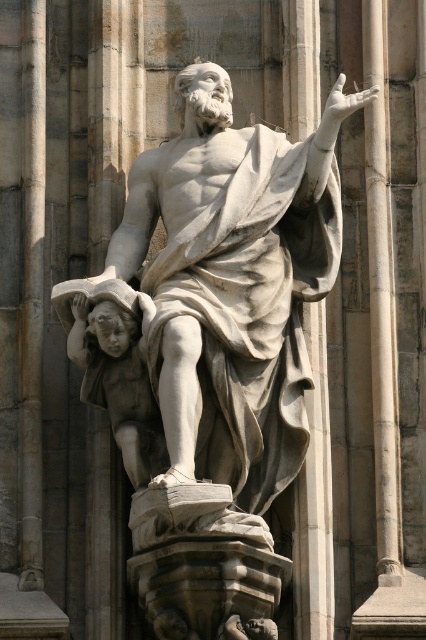
You are an architect designing a new plaza and need to place a statue exactly at coordinates 0.780, 0.739. You see the white marble pillar at center in the image. Can you confirm if the pillar is already at the desired coordinates?

The white marble pillar at center is positioned at point [314,499], so yes, the pillar is already at the desired coordinates.

You are an art conservator assessing the space between the white marble statue at center and the white marble pillar at center. Based on their heights, which one would require a taller ladder to clean the top?

The white marble pillar at center is taller than the white marble statue at center, so you would need a taller ladder to clean the top of the white marble pillar at center.